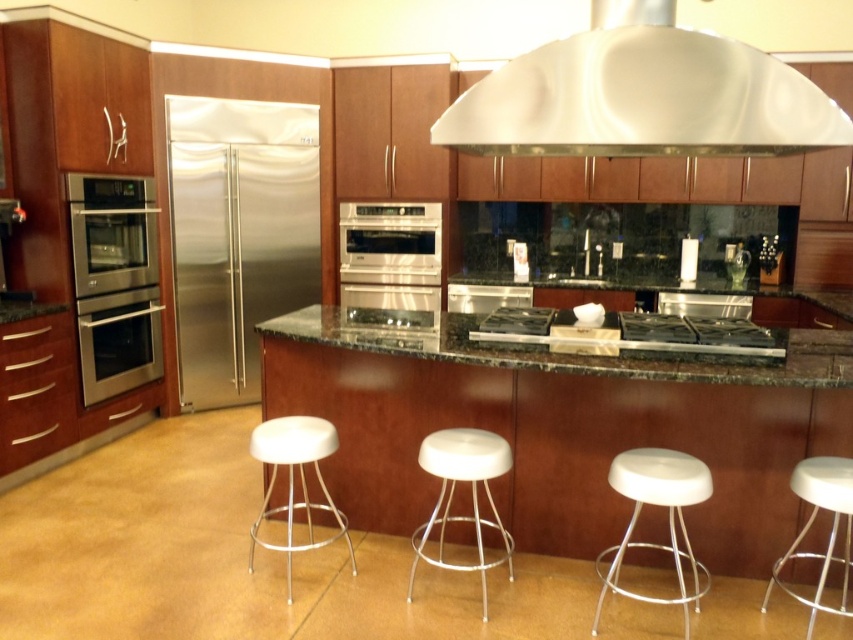
Please provide the coordinates of the stainless steel oven at center in the image. The coordinate system is normalized, with the origin at the bottom left corner of the image. The x and y axes are normalized between 0 and 1, where x increases to the right and y increases upward. The coordinates should be in the format of a point in the form of a tuple with two decimal places, such as point [392,262]. Please answer with the exact coordinates provided in the Objects Description.

The stainless steel oven at center is located at point [392,262].

You are a chef preparing to set up a small dining area in the kitchen. You have a white plastic bar stool at lower right and a black granite countertop at center. Which object would be more suitable for placing a decorative centerpiece, and why?

The black granite countertop at center is larger in size than the white plastic bar stool at lower right, making it more suitable for placing a decorative centerpiece as it provides a stable and spacious surface.